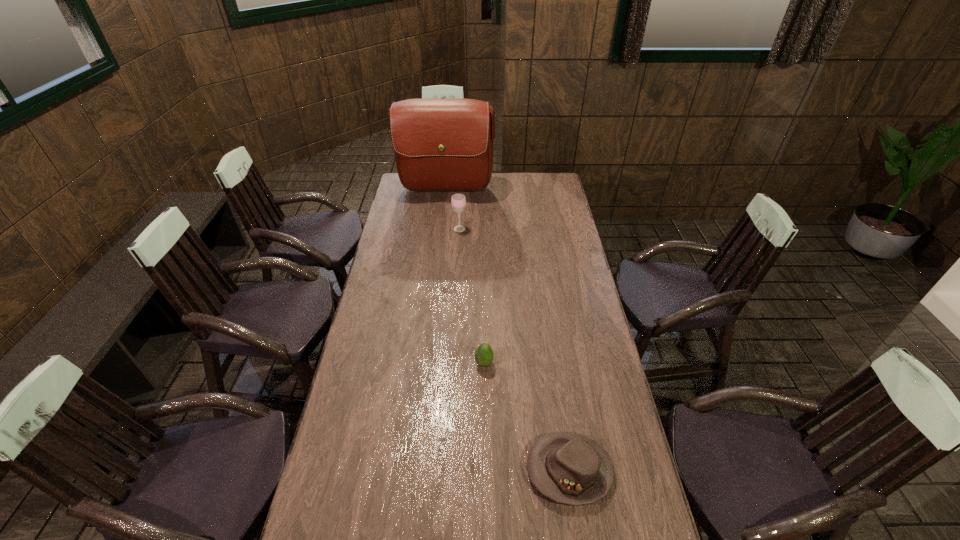
Find the location of a particular element. vacant space situated 0.230m on the decorative side of the hat is located at coordinates (446, 470).

The image size is (960, 540). Find the location of `free spot located on the decorative side of the hat`. free spot located on the decorative side of the hat is located at coordinates (444, 470).

At what (x,y) coordinates should I click in order to perform the action: click on free space located 0.310m on the decorative side of the hat. Please return your answer as a coordinate pair (x, y). Image resolution: width=960 pixels, height=540 pixels. Looking at the image, I should click on [x=420, y=470].

Where is `object that is positioned at the far edge`? object that is positioned at the far edge is located at coordinates pyautogui.click(x=439, y=144).

Find the location of a particular element. Image resolution: width=960 pixels, height=540 pixels. object positioned at the left edge is located at coordinates click(x=439, y=144).

Where is `object that is at the right edge`? This screenshot has width=960, height=540. object that is at the right edge is located at coordinates (569, 468).

Where is `object at the far left corner`? This screenshot has height=540, width=960. object at the far left corner is located at coordinates (439, 144).

The width and height of the screenshot is (960, 540). Identify the location of vacant space at the left edge. (397, 222).

The image size is (960, 540). In the image, there is a desktop. Identify the location of vacant area at the right edge. (586, 285).

The width and height of the screenshot is (960, 540). I want to click on vacant area at the far left corner of the desktop, so click(411, 191).